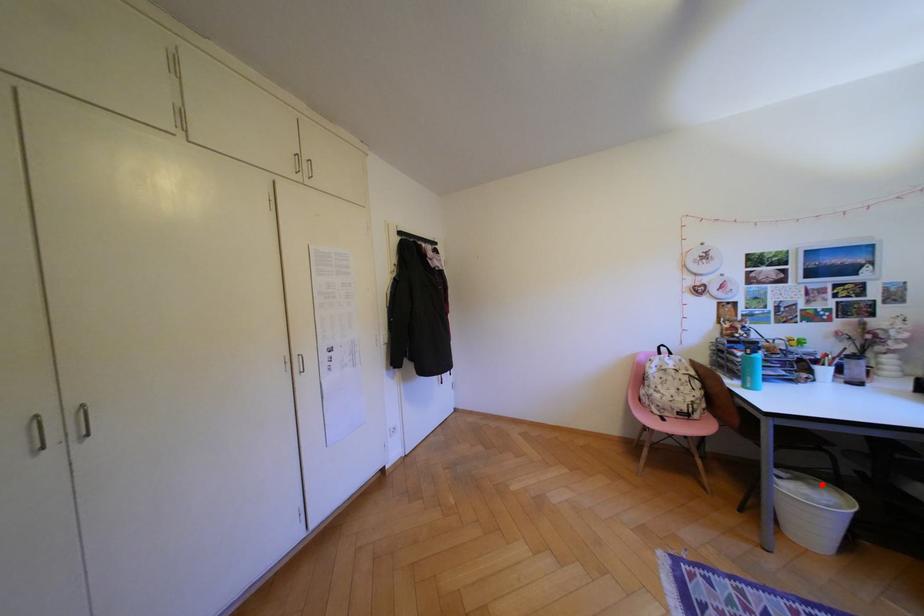
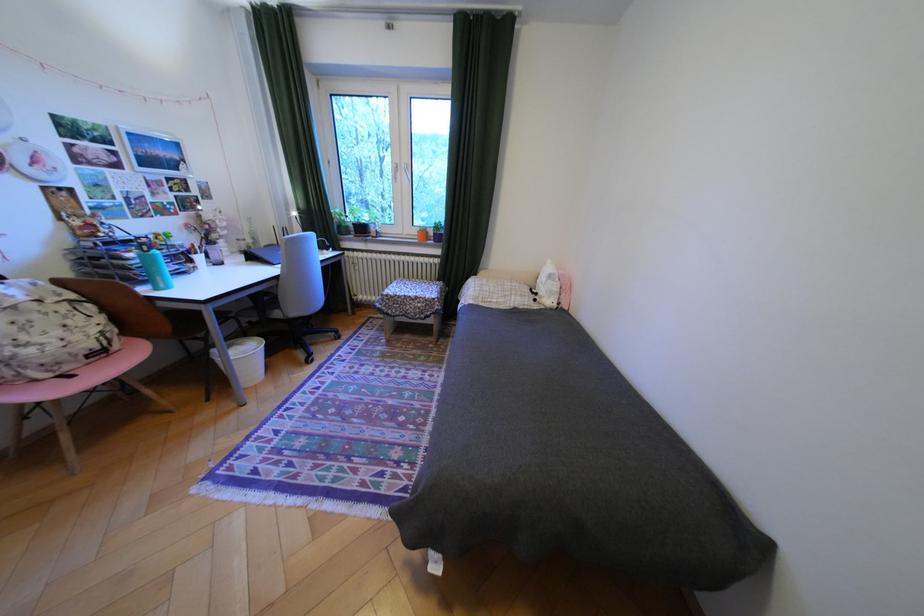
Where in the second image is the point corresponding to the highlighted location from the first image?

(249, 345)